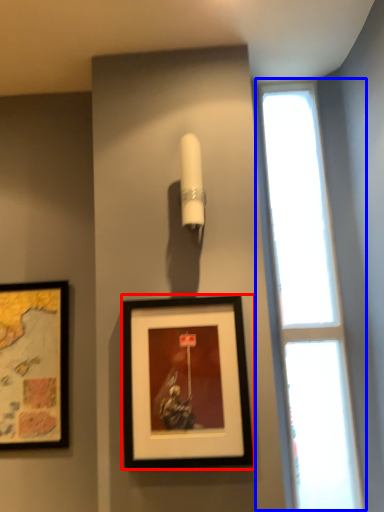
Question: Which object appears farthest to the camera in this image, picture frame (highlighted by a red box) or window (highlighted by a blue box)?

Choices:
 (A) picture frame
 (B) window

Answer: (B)